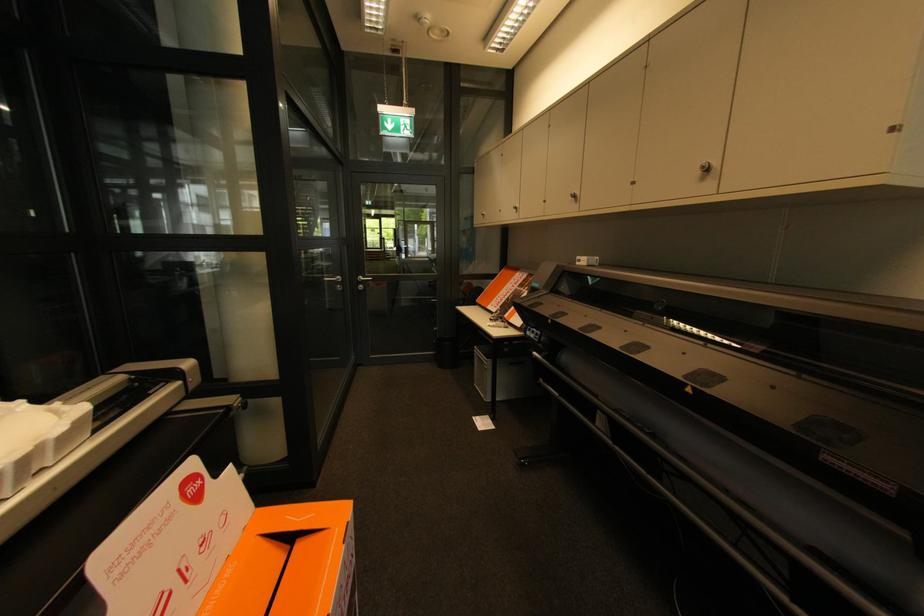
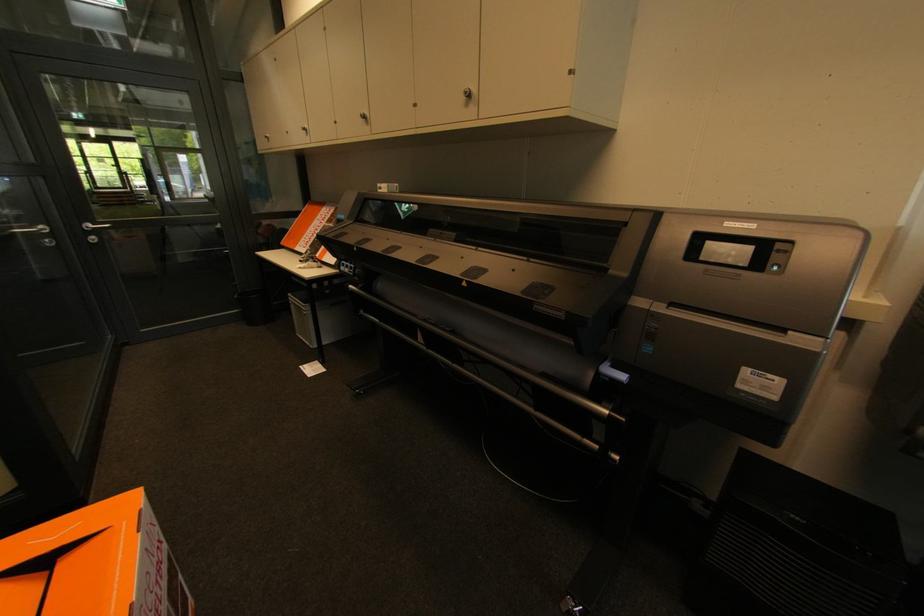
Question: The images are taken continuously from a first-person perspective. In which direction is your viewpoint rotating?

Choices:
 (A) Left
 (B) Right
 (C) Up
 (D) Down

Answer: (B)